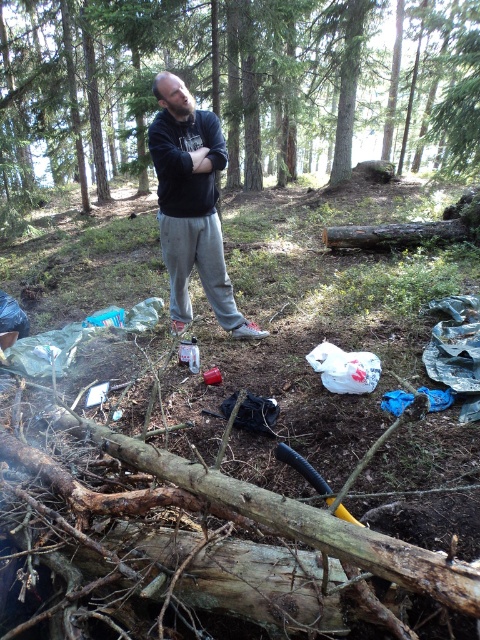
Is green matte tree at center smaller than black sweatshirt at center?

No, green matte tree at center is not smaller than black sweatshirt at center.

Can you confirm if green matte tree at center is bigger than black sweatshirt at center?

Yes.

At what (x,y) coordinates should I click in order to perform the action: click on green matte tree at center. Please return your answer as a coordinate pair (x, y). This screenshot has height=640, width=480. Looking at the image, I should click on (237, 84).

Find the location of a particular element. The width and height of the screenshot is (480, 640). green matte tree at center is located at coordinates (237, 84).